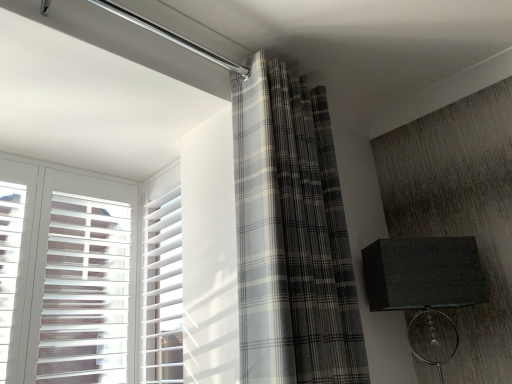
Question: Is matte black lampshade at right smaller than gray plaid curtain at center?

Choices:
 (A) no
 (B) yes

Answer: (B)

Question: Would you say matte black lampshade at right is outside gray plaid curtain at center?

Choices:
 (A) yes
 (B) no

Answer: (A)

Question: Can gray plaid curtain at center be found inside matte black lampshade at right?

Choices:
 (A) no
 (B) yes

Answer: (A)

Question: Considering the relative sizes of matte black lampshade at right and gray plaid curtain at center in the image provided, is matte black lampshade at right shorter than gray plaid curtain at center?

Choices:
 (A) yes
 (B) no

Answer: (A)

Question: Considering the relative positions of matte black lampshade at right and gray plaid curtain at center in the image provided, is matte black lampshade at right to the left of gray plaid curtain at center from the viewer's perspective?

Choices:
 (A) yes
 (B) no

Answer: (B)

Question: Is gray plaid curtain at center situated inside white plastic blinds at left or outside?

Choices:
 (A) outside
 (B) inside

Answer: (A)

Question: Is gray plaid curtain at center in front of or behind white plastic blinds at left in the image?

Choices:
 (A) behind
 (B) front

Answer: (B)

Question: Is point (320, 347) positioned closer to the camera than point (146, 193)?

Choices:
 (A) closer
 (B) farther

Answer: (A)

Question: In terms of size, does gray plaid curtain at center appear bigger or smaller than white plastic blinds at left?

Choices:
 (A) big
 (B) small

Answer: (A)

Question: Considering the positions of white plastic blinds at left and matte black lampshade at right in the image, is white plastic blinds at left bigger or smaller than matte black lampshade at right?

Choices:
 (A) small
 (B) big

Answer: (A)

Question: From the image's perspective, is white plastic blinds at left positioned above or below matte black lampshade at right?

Choices:
 (A) above
 (B) below

Answer: (A)

Question: Is white plastic blinds at left situated inside matte black lampshade at right or outside?

Choices:
 (A) outside
 (B) inside

Answer: (A)

Question: In the image, is white plastic blinds at left positioned in front of or behind matte black lampshade at right?

Choices:
 (A) front
 (B) behind

Answer: (B)

Question: Visually, is gray plaid curtain at center positioned to the left or to the right of matte black lampshade at right?

Choices:
 (A) left
 (B) right

Answer: (A)

Question: In the image, is gray plaid curtain at center positioned in front of or behind matte black lampshade at right?

Choices:
 (A) behind
 (B) front

Answer: (B)